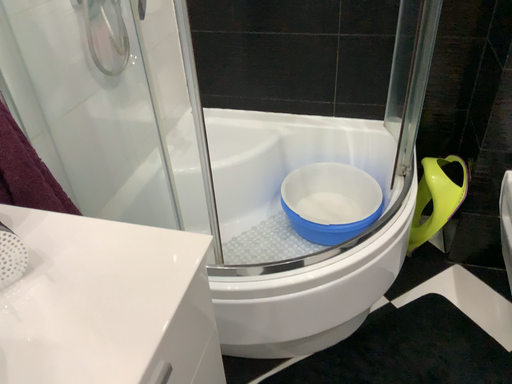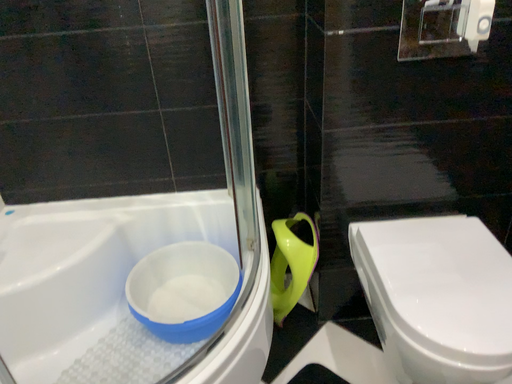
Question: Which way did the camera rotate in the video?

Choices:
 (A) rotated downward
 (B) rotated upward

Answer: (B)